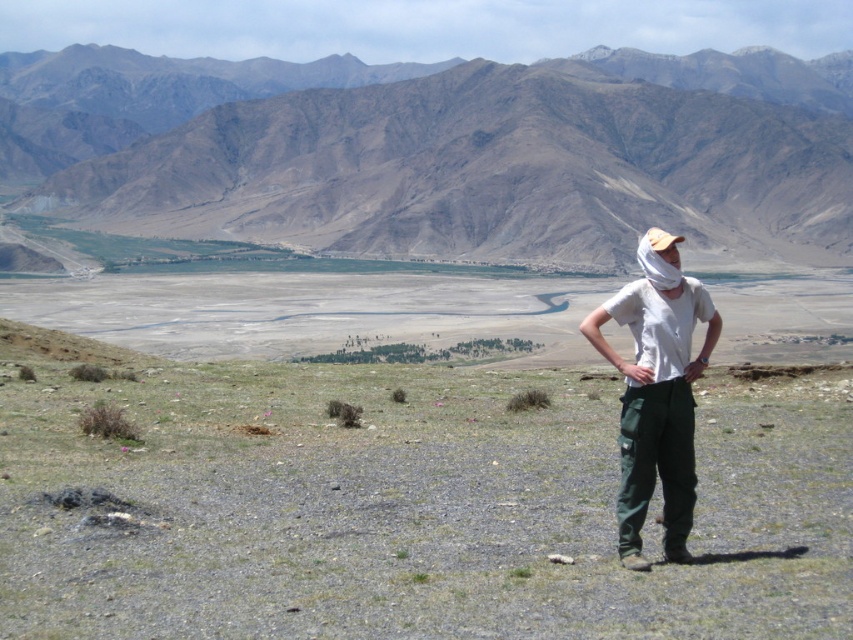
You are a photographer standing at the point closer to the camera between point (741, 129) and point (672, 380). You want to take a photo of the rugged mountains in the background. Which point should you move to in order to get a better composition where the mountains occupy more of the frame?

You should move to point (672, 380) because it is further away from the camera than point (741, 129), allowing the mountains in the background to take up more space in the photo.

You are a hiker standing at the center of the scene. You want to take a photo of the brown rocky mountain at upper center while ensuring the white cotton shirt at center is visible in the frame. Which direction should you face to include both objects in your photo?

The brown rocky mountain at upper center is positioned on the right side of white cotton shirt at center. To include both in the photo, you should face towards the right side of the white cotton shirt at center so that the mountain appears on the right and the shirt remains in the frame.